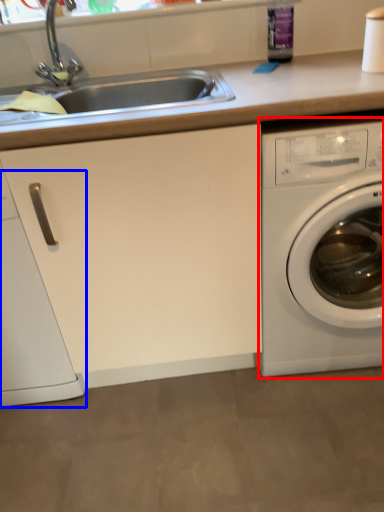
Question: Which object appears farthest to the camera in this image, washing machine (highlighted by a red box) or dish washer (highlighted by a blue box)?

Choices:
 (A) washing machine
 (B) dish washer

Answer: (B)